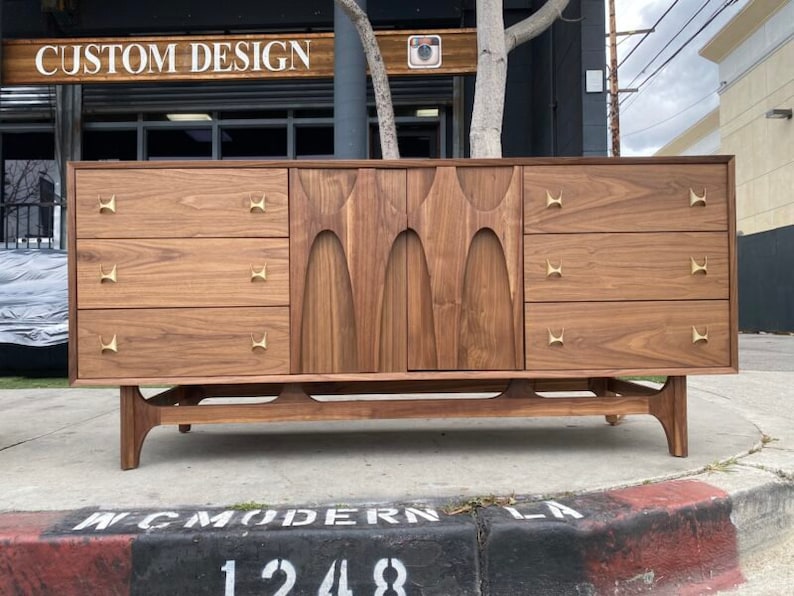
Find the location of `doors on dresser`. doors on dresser is located at coordinates (359, 232), (446, 229).